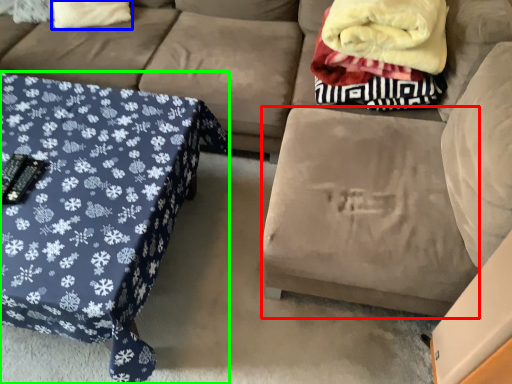
Question: Based on their relative distances, which object is nearer to footrest (highlighted by a red box)? Choose from throw pillow (highlighted by a blue box) and table (highlighted by a green box).

Choices:
 (A) throw pillow
 (B) table

Answer: (B)